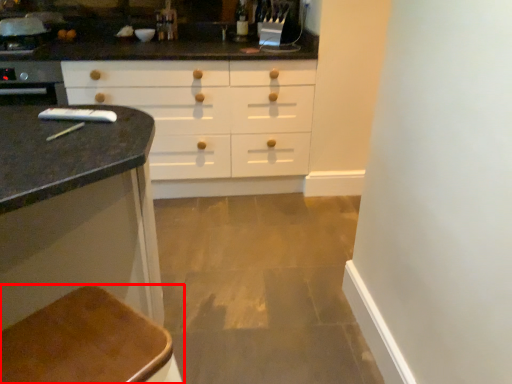
Question: From the image's perspective, where is furniture (annotated by the red box) located in relation to faucet in the image?

Choices:
 (A) above
 (B) below

Answer: (B)